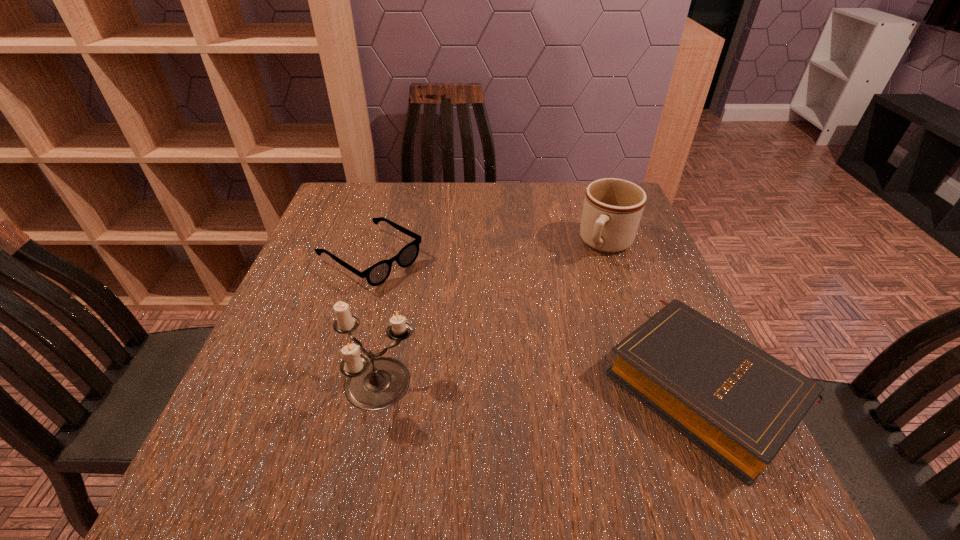
The image size is (960, 540). In order to click on vacant area in the image that satisfies the following two spatial constraints: 1. on the back side of the tallest object; 2. on the left side of the second tallest object in this screenshot , I will do `click(408, 244)`.